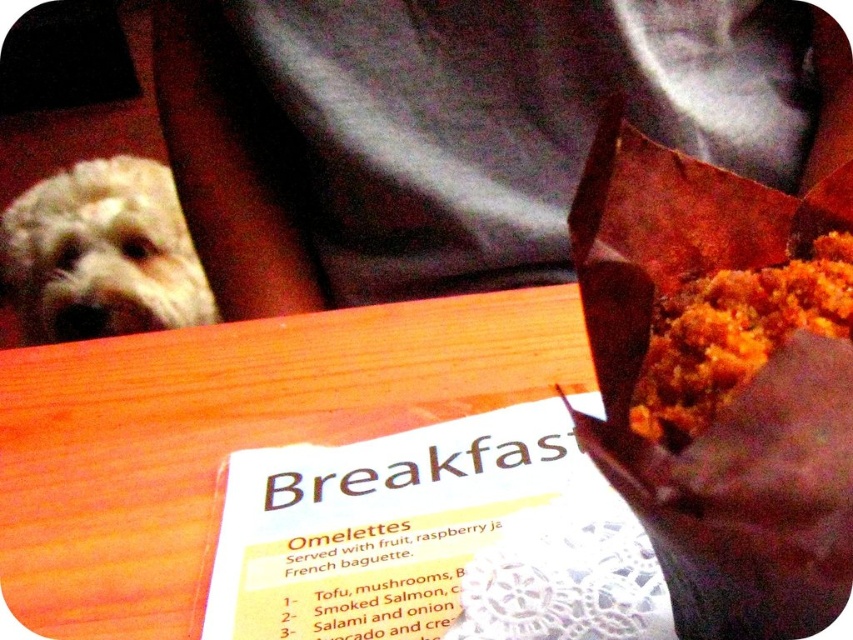
Question: Is white fluffy dog at upper left thinner than golden crumbly muffin at upper right?

Choices:
 (A) yes
 (B) no

Answer: (B)

Question: Does white fluffy dog at upper left appear under golden crumbly muffin at upper right?

Choices:
 (A) no
 (B) yes

Answer: (A)

Question: Does white fluffy dog at upper left appear under golden crumbly muffin at upper right?

Choices:
 (A) no
 (B) yes

Answer: (A)

Question: Which of the following is the closest to the observer?

Choices:
 (A) (32, 316)
 (B) (656, 355)

Answer: (B)